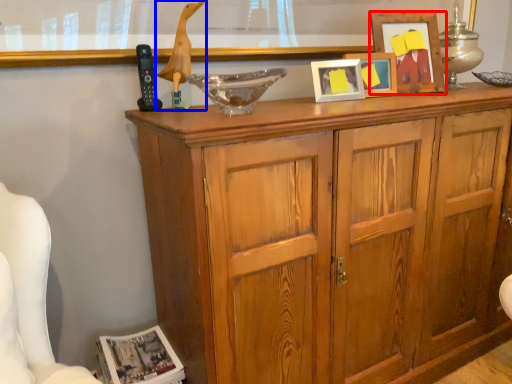
Question: Which object appears farthest to the camera in this image, picture frame (highlighted by a red box) or mannequin (highlighted by a blue box)?

Choices:
 (A) picture frame
 (B) mannequin

Answer: (A)